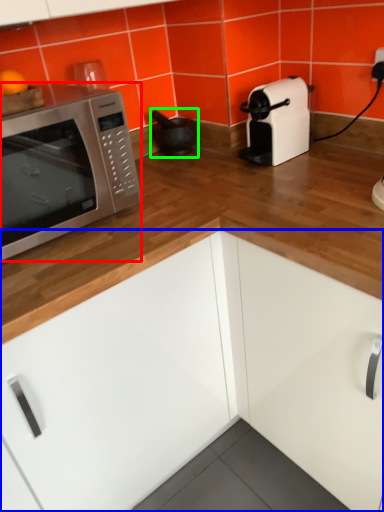
Question: Considering the real-world distances, which object is closest to microwave oven (highlighted by a red box)? cabinetry (highlighted by a blue box) or appliance (highlighted by a green box).

Choices:
 (A) cabinetry
 (B) appliance

Answer: (A)